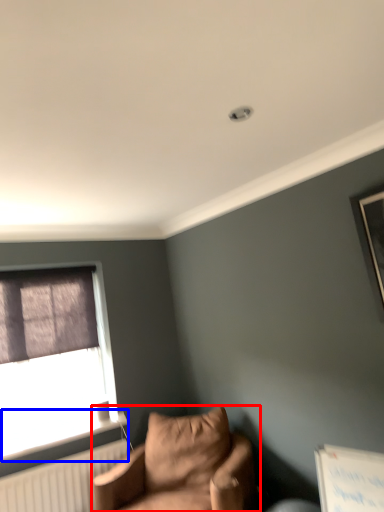
Question: Which object is closer to the camera taking this photo, studio couch (highlighted by a red box) or window sill (highlighted by a blue box)?

Choices:
 (A) studio couch
 (B) window sill

Answer: (A)